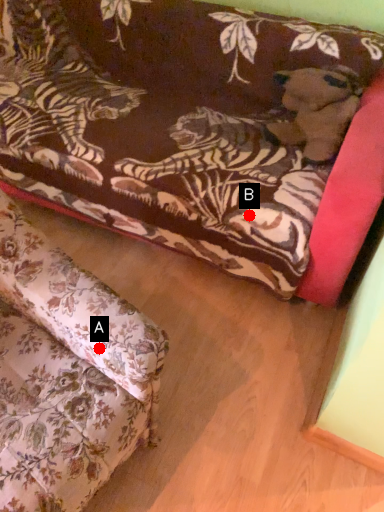
Question: Two points are circled on the image, labeled by A and B beside each circle. Which point appears farthest from the camera in this image?

Choices:
 (A) A is further
 (B) B is further

Answer: (B)